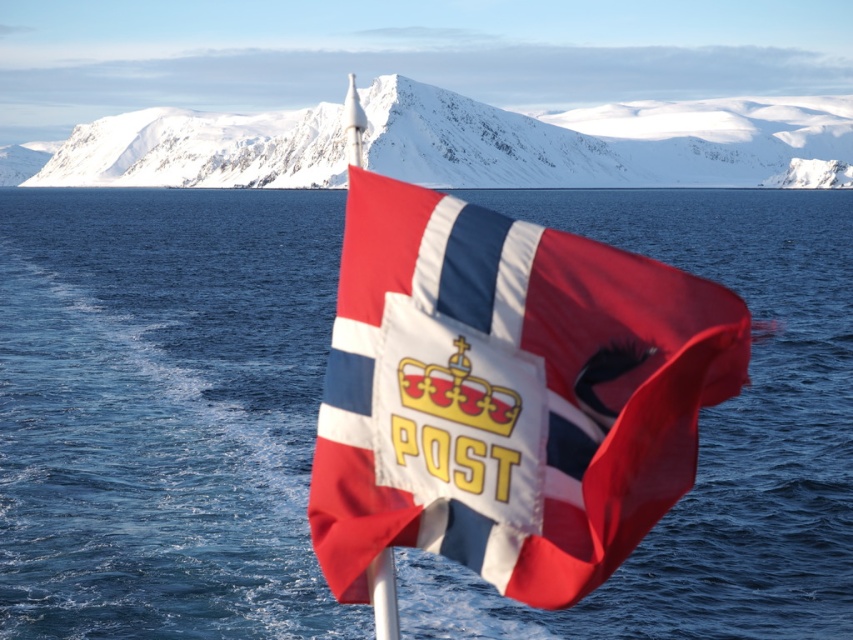
Is blue water at center positioned in front of snowy rock at upper center?

Yes, blue water at center is closer to the viewer.

Where is `blue water at center`? blue water at center is located at coordinates (163, 412).

What do you see at coordinates (163, 412) in the screenshot?
I see `blue water at center` at bounding box center [163, 412].

What are the coordinates of `blue water at center` in the screenshot? It's located at (163, 412).

Which of these two, matte fabric flag at center or snowy rock at upper center, stands taller?

snowy rock at upper center

Is point (704, 348) farther from camera compared to point (235, 131)?

No, it is not.

Locate an element on the screen. This screenshot has height=640, width=853. matte fabric flag at center is located at coordinates coord(508,394).

Between blue water at center and matte fabric flag at center, which one is positioned higher?

blue water at center is higher up.

Does blue water at center appear on the right side of matte fabric flag at center?

No, blue water at center is not to the right of matte fabric flag at center.

Which is in front, point (198, 340) or point (641, 332)?

Point (641, 332) is more forward.

You are a GUI agent. You are given a task and a screenshot of the screen. Output one action in this format:
    pyautogui.click(x=<x>, y=<y>)
    Task: Click on the blue water at center
    This screenshot has width=853, height=640.
    Given the screenshot: What is the action you would take?
    pyautogui.click(x=163, y=412)